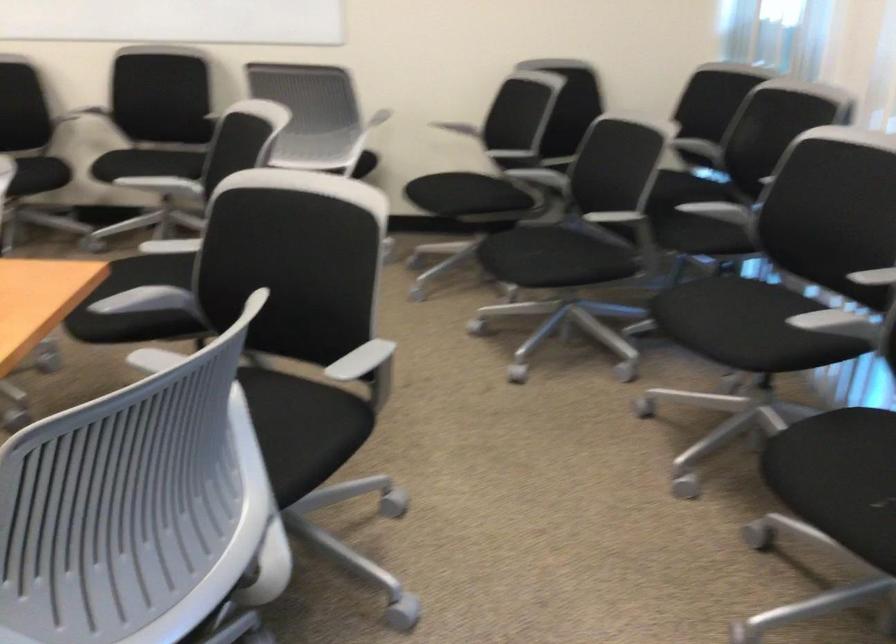
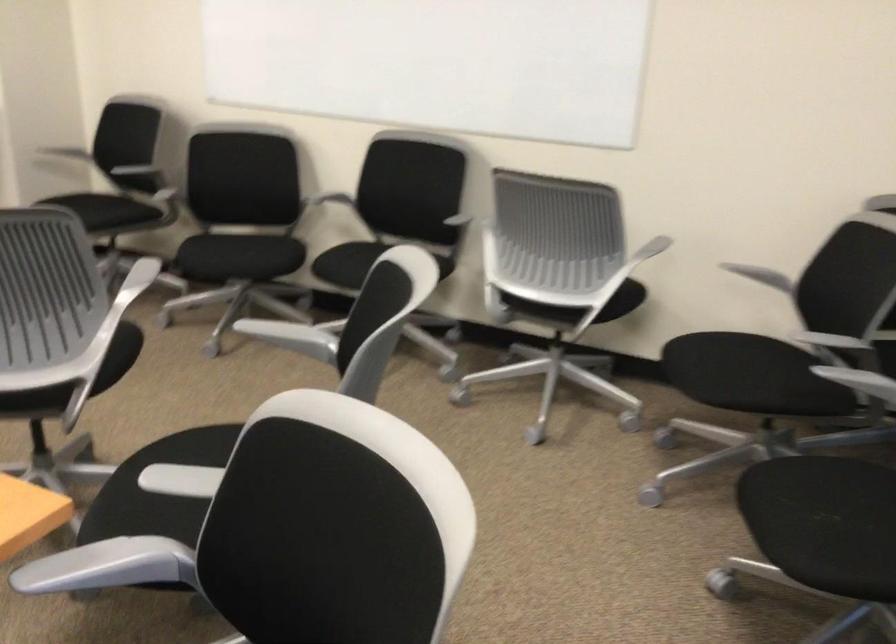
Where in the second image is the point corresponding to (107,106) from the first image?

(340, 196)